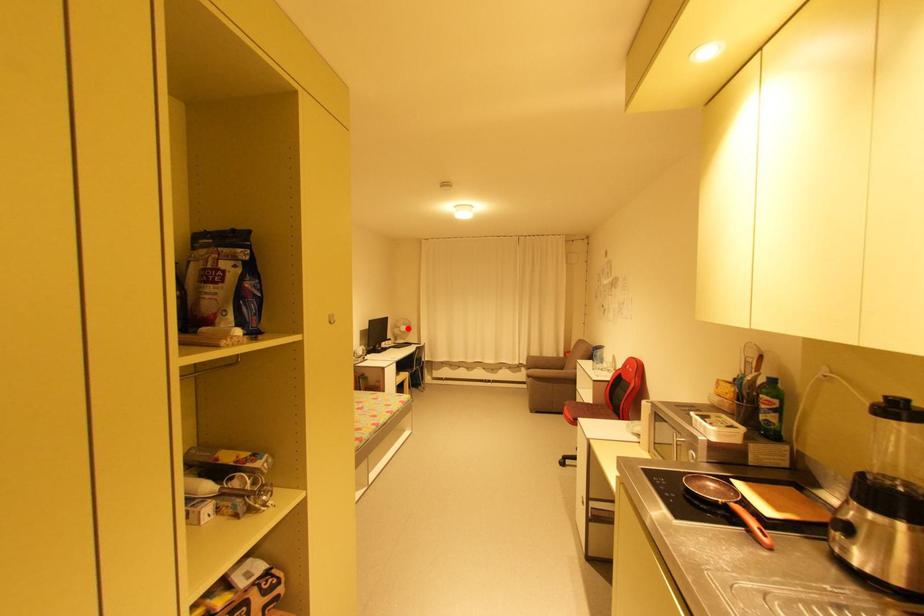
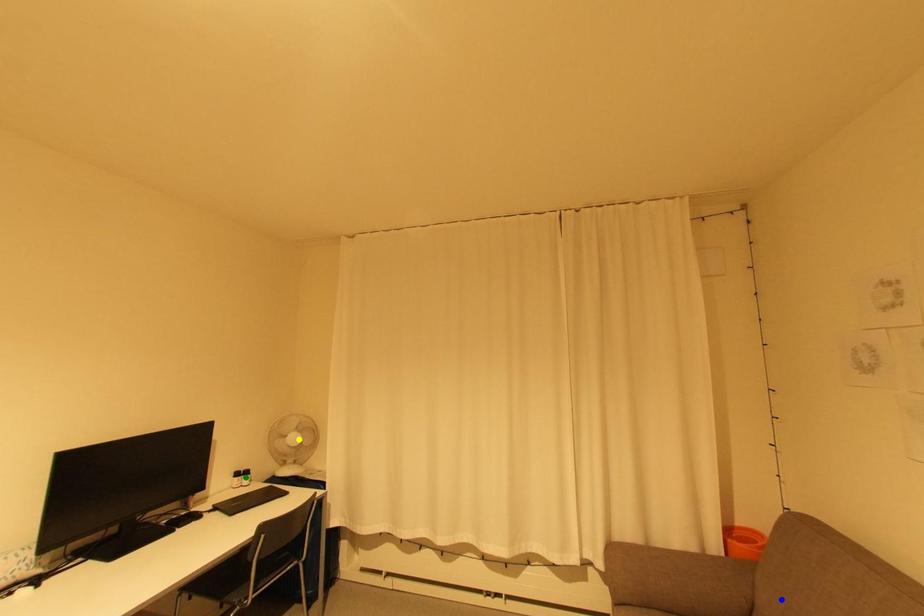
Question: I am providing you with two images of the same scene from different viewpoints. A red point is marked on the first image. You are given multiple points on the second image. Which point in image 2 represents the same 3d spot as the red point in image 1?

Choices:
 (A) blue point
 (B) green point
 (C) yellow point

Answer: (C)